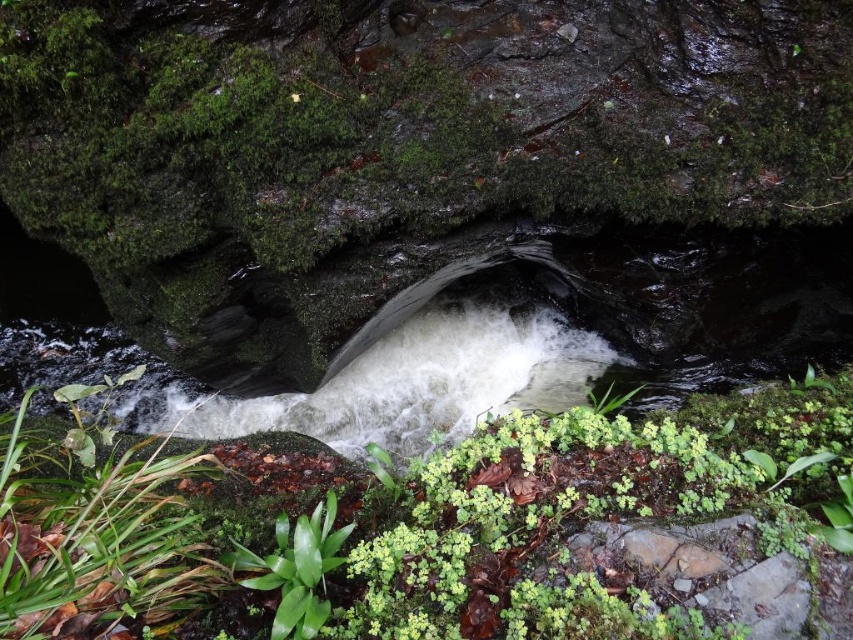
Can you confirm if green leafy plant at center is bigger than green leafy plant at lower center?

Yes, green leafy plant at center is bigger than green leafy plant at lower center.

Which is in front, point (552, 541) or point (282, 573)?

Positioned in front is point (552, 541).

Which is in front, point (259, 497) or point (321, 522)?

Point (321, 522) is more forward.

I want to click on green leafy plant at center, so click(x=438, y=516).

Which is below, green leafy plant at center or green leafy plant at lower left?

green leafy plant at lower left is lower down.

Is green leafy plant at center positioned in front of green leafy plant at lower left?

No, it is behind green leafy plant at lower left.

Does point (775, 468) lie in front of point (172, 564)?

Yes, point (775, 468) is in front of point (172, 564).

At what (x,y) coordinates should I click in order to perform the action: click on green leafy plant at center. Please return your answer as a coordinate pair (x, y). Looking at the image, I should click on (438, 516).

Is point (51, 570) positioned before point (296, 630)?

Yes.

Between point (28, 547) and point (229, 561), which one is positioned in front?

Point (28, 547) is more forward.

The image size is (853, 640). What are the coordinates of `green leafy plant at lower left` in the screenshot? It's located at (96, 529).